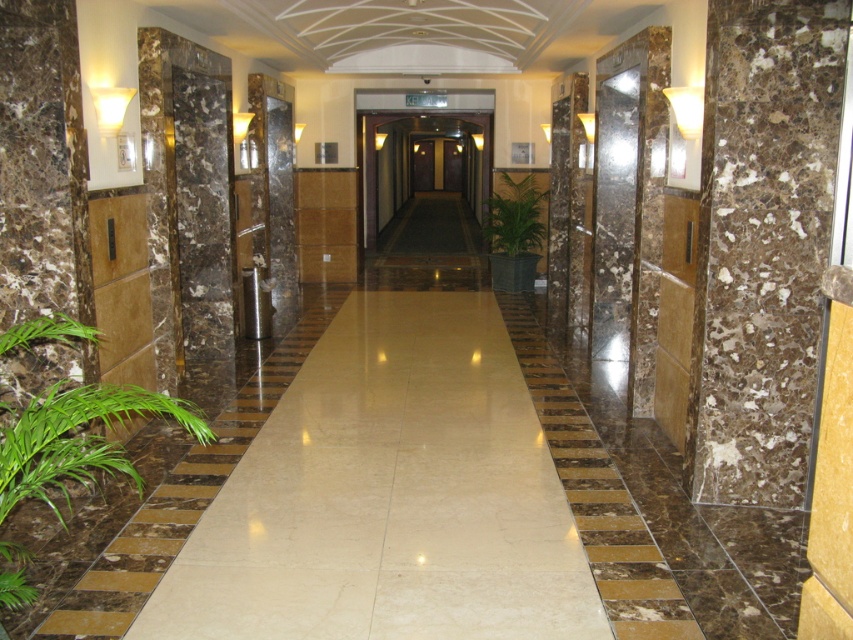
You are a maintenance worker who needs to water the plants in the corridor. You are currently standing at the entrance of the corridor. Which plant should you approach first to water it, the green leafy plant at lower left or the green leafy plant at center?

You should approach the green leafy plant at lower left first because it is in front of the green leafy plant at center, meaning it is closer to you from your current position at the entrance.

Consider the image. You are a maintenance worker who needs to water the plants in the corridor. You are currently standing at the entrance of the corridor. Which plant should you water first, the green leafy plant at lower left or the green leafy plant at center?

The green leafy plant at lower left is positioned under the green leafy plant at center, so you should water the green leafy plant at lower left first as it is closer to you.

From the picture: You are standing at the entrance of the corridor and want to place a new decorative item exactly halfway between the green leafy plant at lower left and the nearest wall sconce. Where should you place it?

The green leafy plant at lower left is located at point (76, 438). To determine the halfway point between it and the nearest wall sconce, you would need to identify the coordinates of the nearest sconce first. Since the corridor has symmetrically placed sconces, the nearest one would likely be along the same wall as the plant. Once the sconce coordinates are known, the midpoint can be calculated by averaging the x and y values of both points.